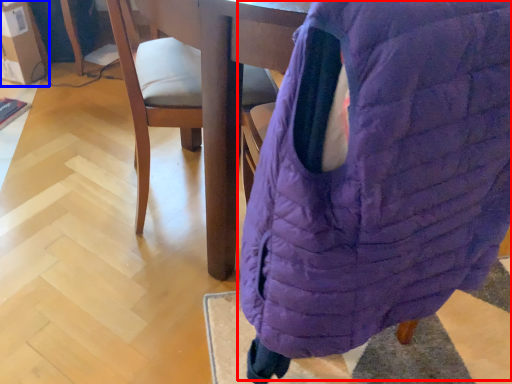
Question: Among these objects, which one is nearest to the camera, bean bag chair (highlighted by a red box) or cardboard box (highlighted by a blue box)?

Choices:
 (A) bean bag chair
 (B) cardboard box

Answer: (A)